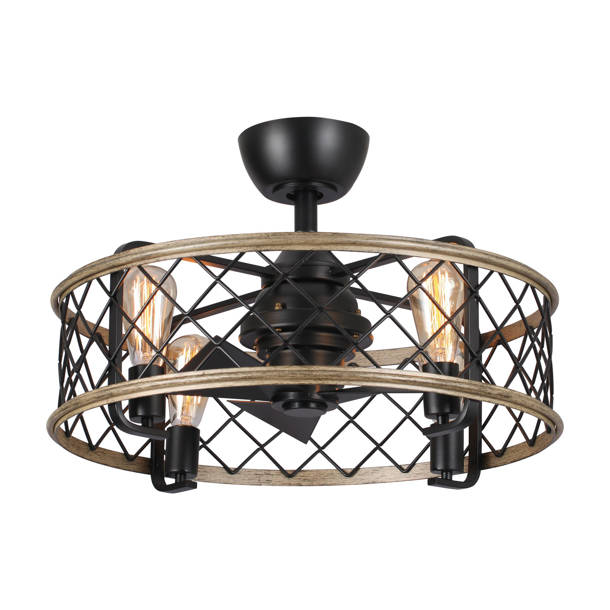
You are a GUI agent. You are given a task and a screenshot of the screen. Output one action in this format:
    pyautogui.click(x=<x>, y=<y>)
    Task: Click on the bottom of wooden frame
    
    Given the screenshot: What is the action you would take?
    pyautogui.click(x=360, y=379)